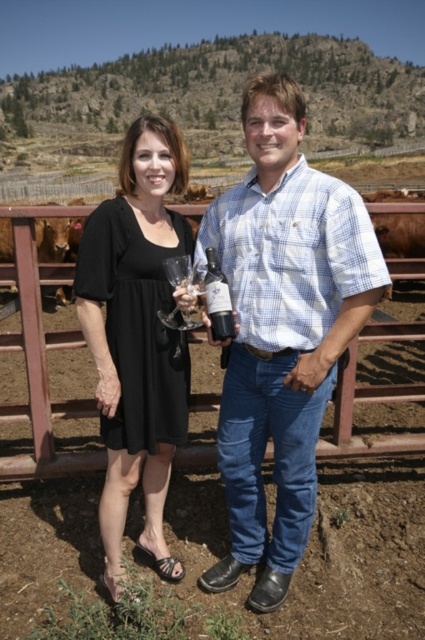
Is point (121, 538) closer to camera compared to point (214, 259)?

Yes, point (121, 538) is closer to viewer.

Which is in front, point (116, 426) or point (207, 250)?

Positioned in front is point (116, 426).

The image size is (425, 640). I want to click on black matte dress at center, so click(138, 337).

Measure the distance between blue checkered shirt at center and camera.

They are 50.24 feet apart.

From the picture: Can you confirm if blue checkered shirt at center is shorter than dark red glass bottle at center?

Incorrect, blue checkered shirt at center's height does not fall short of dark red glass bottle at center's.

Is point (257, 80) behind point (209, 317)?

No, it is in front of (209, 317).

At what (x,y) coordinates should I click in order to perform the action: click on blue checkered shirt at center. Please return your answer as a coordinate pair (x, y). The height and width of the screenshot is (640, 425). Looking at the image, I should click on (282, 328).

Does blue checkered shirt at center lie in front of black matte dress at center?

No, it is behind black matte dress at center.

Is point (234, 573) positioned in front of point (118, 380)?

That is True.

This screenshot has width=425, height=640. Find the location of `blue checkered shirt at center`. blue checkered shirt at center is located at coordinates (282, 328).

This screenshot has width=425, height=640. In order to click on blue checkered shirt at center in this screenshot , I will do `click(282, 328)`.